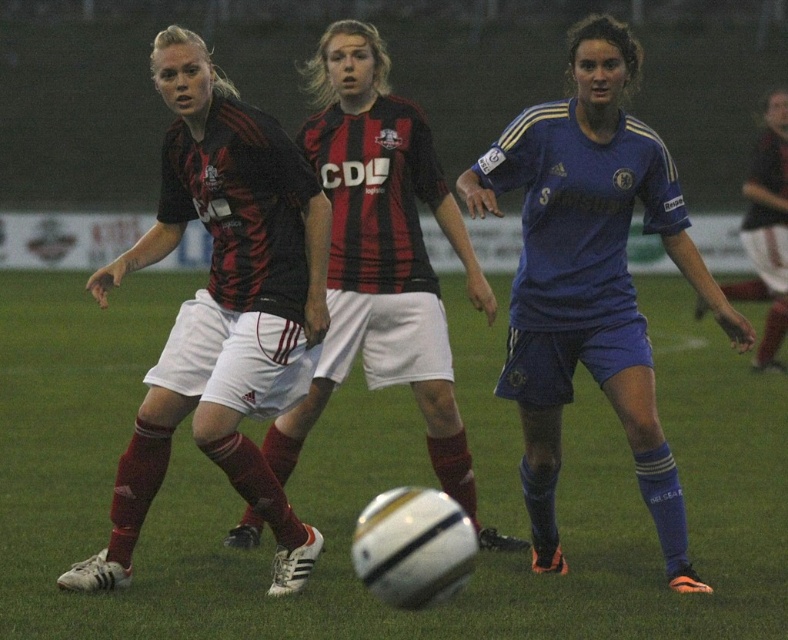
You are a soccer coach analyzing the field positioning. You notice the black matte jersey at left and the blue jersey at center. Which player is taking up more horizontal space on the field?

The blue jersey at center is taking up more horizontal space since it has a greater width than the black matte jersey at left.

You are a soccer coach analyzing the play. You see the black matte jersey at left and the blue jersey at center. Which player is positioned lower on the field?

The black matte jersey at left is positioned below the blue jersey at center, so the player in the black matte jersey at left is lower on the field.